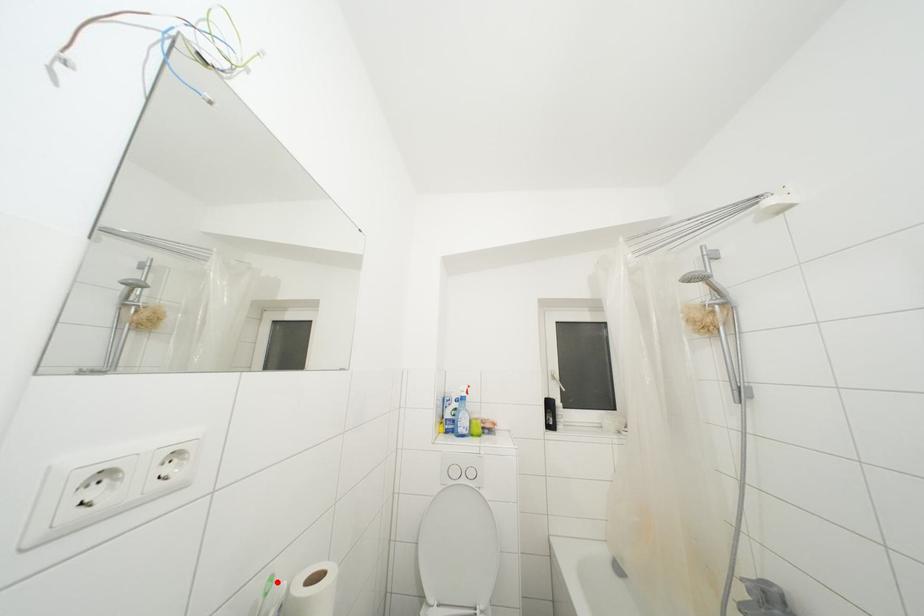
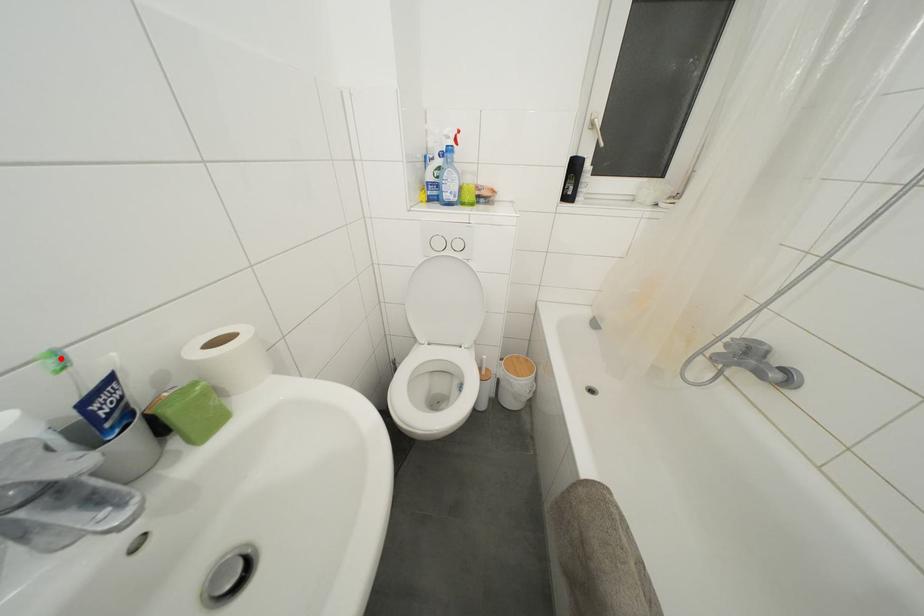
I am providing you with two images of the same scene from different viewpoints. A red point is marked on the first image and another point is marked on the second image. Is the marked point in image1 the same physical position as the marked point in image2?

Yes